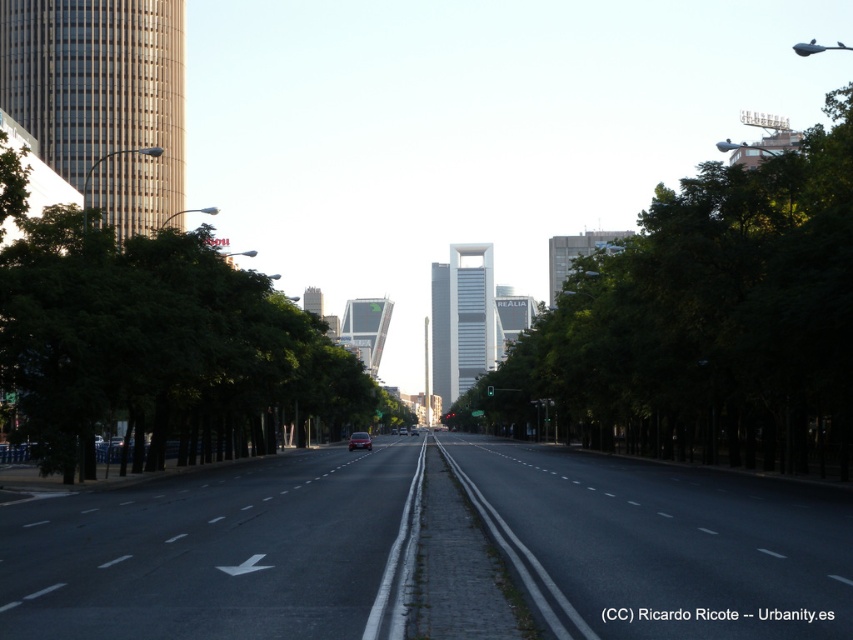
Question: Which point is farther from the camera taking this photo?

Choices:
 (A) (349, 442)
 (B) (39, 396)

Answer: (A)

Question: Is green leafy tree at center positioned before metallic silver car at center?

Choices:
 (A) no
 (B) yes

Answer: (B)

Question: Considering the relative positions of green leafy tree at left and metallic silver car at center in the image provided, where is green leafy tree at left located with respect to metallic silver car at center?

Choices:
 (A) left
 (B) right

Answer: (A)

Question: Which of these objects is positioned farthest from the metallic silver car at center?

Choices:
 (A) green leafy tree at left
 (B) green leafy tree at center

Answer: (B)

Question: Which point is closer to the camera?

Choices:
 (A) green leafy tree at left
 (B) green leafy tree at center
 (C) metallic silver car at center

Answer: (A)

Question: Is green leafy tree at center bigger than metallic silver car at center?

Choices:
 (A) no
 (B) yes

Answer: (B)